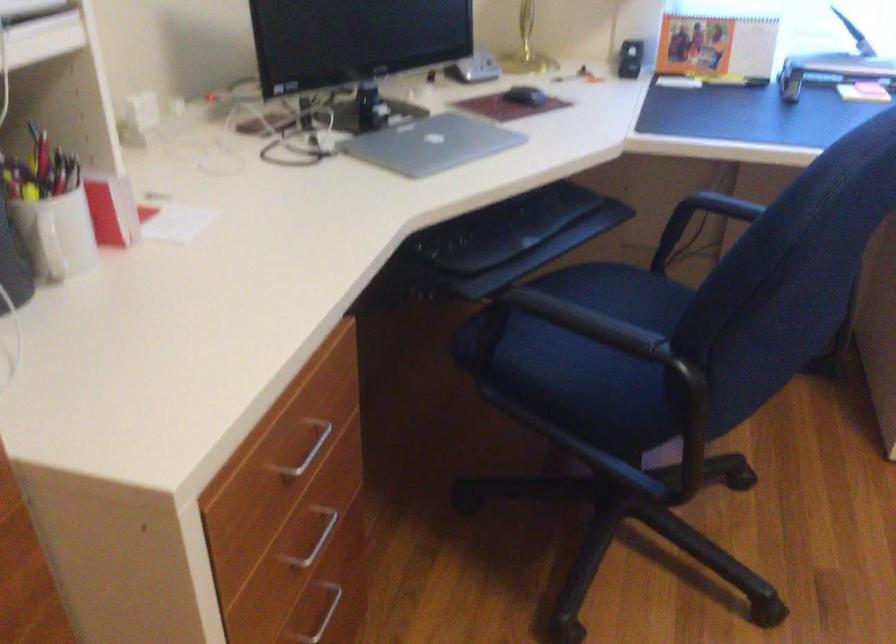
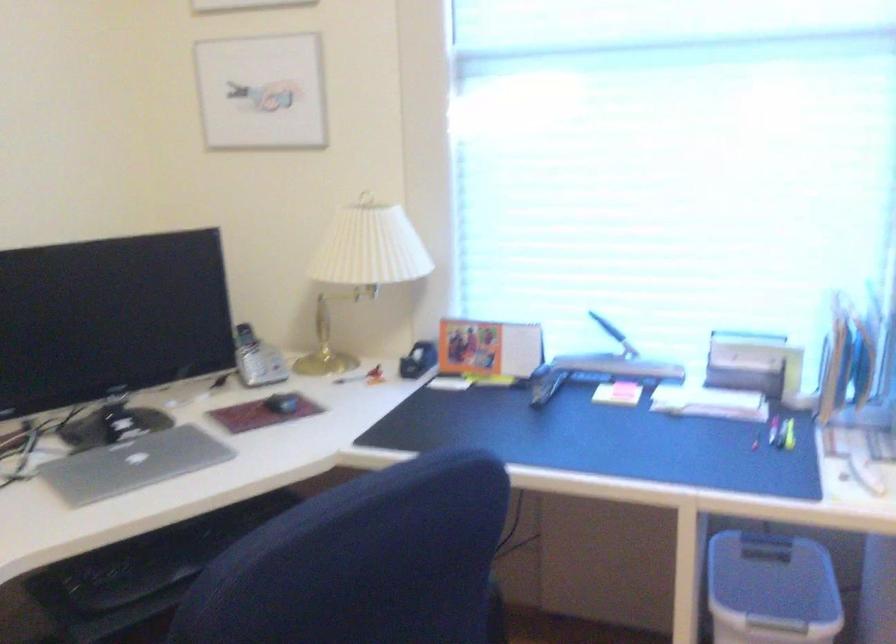
In the second image, find the point that corresponds to point (432, 144) in the first image.

(133, 464)